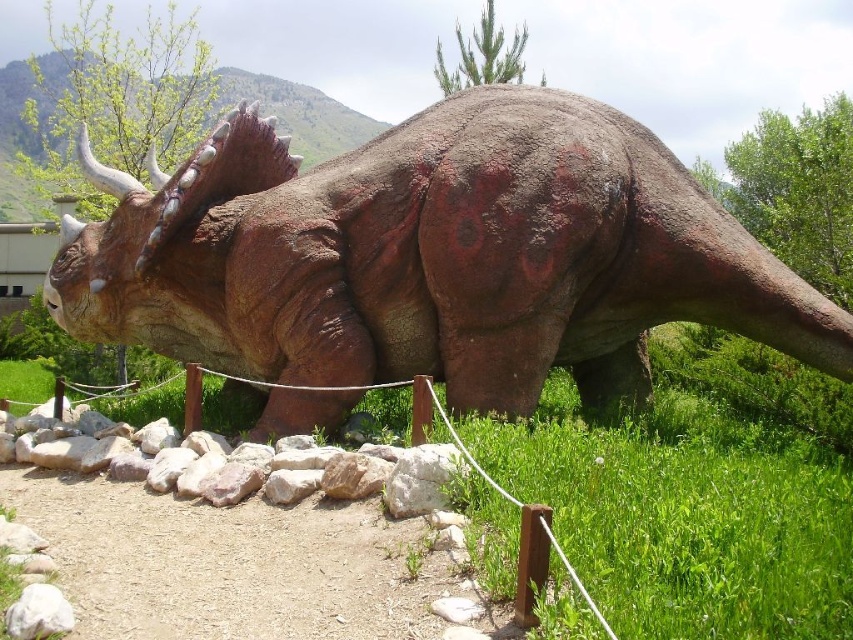
Measure the distance between point (61,323) and camera.

Point (61,323) and camera are 5.16 meters apart from each other.

What are the coordinates of `rustic stone triceratops at center` in the screenshot? It's located at (433, 257).

Measure the distance between rustic stone triceratops at center and camera.

They are 4.07 meters apart.

Find the location of a particular element. rustic stone triceratops at center is located at coordinates (433, 257).